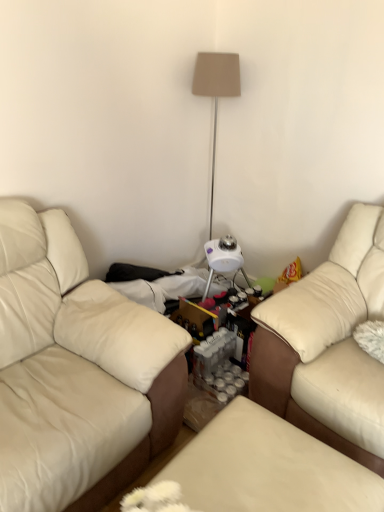
Question: Is beige leather couch at left, the 2th studio couch from the right, not close to beige fabric lampshade at upper center?

Choices:
 (A) no
 (B) yes

Answer: (B)

Question: From the image's perspective, is beige leather couch at left, the first studio couch when ordered from left to right, above beige fabric lampshade at upper center?

Choices:
 (A) no
 (B) yes

Answer: (A)

Question: Is beige leather couch at left, the first studio couch when ordered from left to right, behind beige fabric lampshade at upper center?

Choices:
 (A) yes
 (B) no

Answer: (B)

Question: From a real-world perspective, is beige leather couch at left, the first studio couch when ordered from left to right, below beige fabric lampshade at upper center?

Choices:
 (A) yes
 (B) no

Answer: (A)

Question: Is beige leather couch at left, the first studio couch when ordered from left to right, positioned before beige fabric lampshade at upper center?

Choices:
 (A) yes
 (B) no

Answer: (A)

Question: Does point (345, 365) appear closer or farther from the camera than point (29, 269)?

Choices:
 (A) closer
 (B) farther

Answer: (A)

Question: Based on their positions, is leather couch at right, positioned as the 2th studio couch in left-to-right order, located to the left or right of beige leather couch at left, the 2th studio couch from the right?

Choices:
 (A) right
 (B) left

Answer: (A)

Question: Considering the positions of leather couch at right, positioned as the 2th studio couch in left-to-right order, and beige leather couch at left, the first studio couch when ordered from left to right, in the image, is leather couch at right, positioned as the 2th studio couch in left-to-right order, taller or shorter than beige leather couch at left, the first studio couch when ordered from left to right,?

Choices:
 (A) tall
 (B) short

Answer: (B)

Question: Which is correct: leather couch at right, positioned as the 2th studio couch in left-to-right order, is inside beige leather couch at left, the 2th studio couch from the right, or outside of it?

Choices:
 (A) outside
 (B) inside

Answer: (A)

Question: From a real-world perspective, is beige leather couch at left, the 2th studio couch from the right, physically located above or below leather ottoman at center?

Choices:
 (A) above
 (B) below

Answer: (A)

Question: Is beige leather couch at left, the first studio couch when ordered from left to right, bigger or smaller than leather ottoman at center?

Choices:
 (A) small
 (B) big

Answer: (B)

Question: Does point (x=61, y=500) appear closer or farther from the camera than point (x=370, y=503)?

Choices:
 (A) farther
 (B) closer

Answer: (A)

Question: Visually, is beige leather couch at left, the 2th studio couch from the right, positioned to the left or to the right of leather ottoman at center?

Choices:
 (A) right
 (B) left

Answer: (B)

Question: Looking at their shapes, would you say beige fabric lampshade at upper center is wider or thinner than beige leather couch at left, the 2th studio couch from the right?

Choices:
 (A) thin
 (B) wide

Answer: (A)

Question: Is beige fabric lampshade at upper center taller or shorter than beige leather couch at left, the first studio couch when ordered from left to right?

Choices:
 (A) tall
 (B) short

Answer: (A)